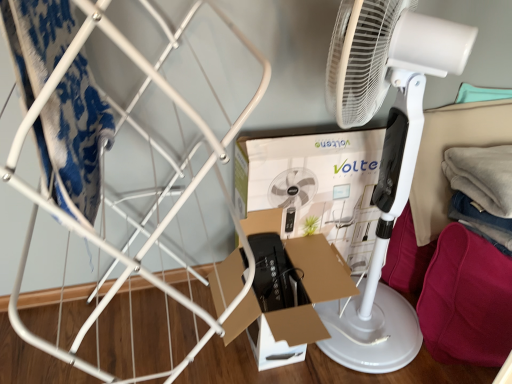
Question: From a real-world perspective, is burgundy fabric cushion at lower right physically located above or below white plastic mechanical fan at center?

Choices:
 (A) below
 (B) above

Answer: (A)

Question: Is burgundy fabric cushion at lower right situated inside white plastic mechanical fan at center or outside?

Choices:
 (A) inside
 (B) outside

Answer: (B)

Question: Estimate the real-world distances between objects in this image. Which object is closer to the white cardboard box at center?

Choices:
 (A) cardboard box at center
 (B) white plastic mechanical fan at center
 (C) burgundy fabric cushion at lower right

Answer: (A)

Question: Which object is the farthest from the white plastic mechanical fan at center?

Choices:
 (A) cardboard box at center
 (B) burgundy fabric cushion at lower right
 (C) white cardboard box at center

Answer: (A)